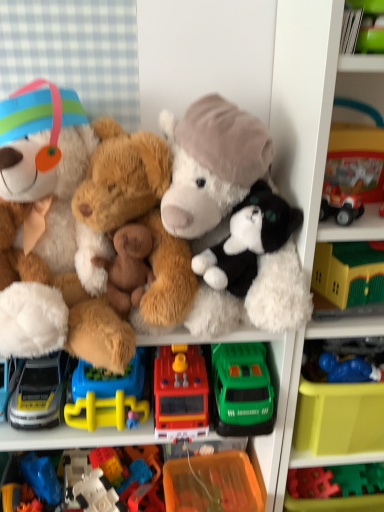
Question: Can you confirm if brown plush bear at center, marked as the 4th toy in a right-to-left arrangement, is wider than rubber fire truck at center, the fourth toy viewed from the left?

Choices:
 (A) yes
 (B) no

Answer: (B)

Question: Does brown plush bear at center, marked as the 4th toy in a right-to-left arrangement, touch rubber fire truck at center, the fourth toy viewed from the left?

Choices:
 (A) yes
 (B) no

Answer: (B)

Question: From a real-world perspective, is brown plush bear at center, marked as the third toy in a left-to-right arrangement, below rubber fire truck at center, which ranks as the third toy in right-to-left order?

Choices:
 (A) yes
 (B) no

Answer: (B)

Question: Would you say brown plush bear at center, marked as the 4th toy in a right-to-left arrangement, is outside rubber fire truck at center, the fourth toy viewed from the left?

Choices:
 (A) yes
 (B) no

Answer: (A)

Question: Does brown plush bear at center, marked as the 4th toy in a right-to-left arrangement, come behind rubber fire truck at center, the fourth toy viewed from the left?

Choices:
 (A) yes
 (B) no

Answer: (B)

Question: Is translucent plastic building blocks at center, which is the second toy from left to right, in front of or behind green plastic car at center, the 2th toy when ordered from right to left, in the image?

Choices:
 (A) front
 (B) behind

Answer: (B)

Question: From the image's perspective, is translucent plastic building blocks at center, which is the fifth toy from right to left, positioned above or below green plastic car at center, acting as the fifth toy starting from the left?

Choices:
 (A) below
 (B) above

Answer: (A)

Question: Is translucent plastic building blocks at center, which is the second toy from left to right, inside the boundaries of green plastic car at center, acting as the fifth toy starting from the left, or outside?

Choices:
 (A) inside
 (B) outside

Answer: (B)

Question: In the image, is translucent plastic building blocks at center, which is the fifth toy from right to left, on the left side or the right side of green plastic car at center, acting as the fifth toy starting from the left?

Choices:
 (A) right
 (B) left

Answer: (B)

Question: Relative to fluffy white teddy bear at left, arranged as the 3th teddy bear when viewed from the right, is blue rubber toy at lower right, marked as the 6th toy in a left-to-right arrangement, in front or behind?

Choices:
 (A) front
 (B) behind

Answer: (B)

Question: Does point (364, 360) appear closer or farther from the camera than point (49, 224)?

Choices:
 (A) farther
 (B) closer

Answer: (A)

Question: In terms of height, does blue rubber toy at lower right, which is counted as the first toy, starting from the right, look taller or shorter compared to fluffy white teddy bear at left, arranged as the 3th teddy bear when viewed from the right?

Choices:
 (A) short
 (B) tall

Answer: (A)

Question: From a real-world perspective, is blue rubber toy at lower right, which is counted as the first toy, starting from the right, physically located above or below fluffy white teddy bear at left, acting as the first teddy bear starting from the left?

Choices:
 (A) above
 (B) below

Answer: (B)

Question: From a real-world perspective, is fluffy brown teddy bear at center, arranged as the second teddy bear when viewed from the right, physically located above or below matte blue car at lower left, which is counted as the sixth toy, starting from the right?

Choices:
 (A) below
 (B) above

Answer: (B)

Question: Considering the positions of fluffy brown teddy bear at center, arranged as the second teddy bear when viewed from the right, and matte blue car at lower left, which is counted as the sixth toy, starting from the right, in the image, is fluffy brown teddy bear at center, arranged as the second teddy bear when viewed from the right, taller or shorter than matte blue car at lower left, which is counted as the sixth toy, starting from the right,?

Choices:
 (A) short
 (B) tall

Answer: (B)